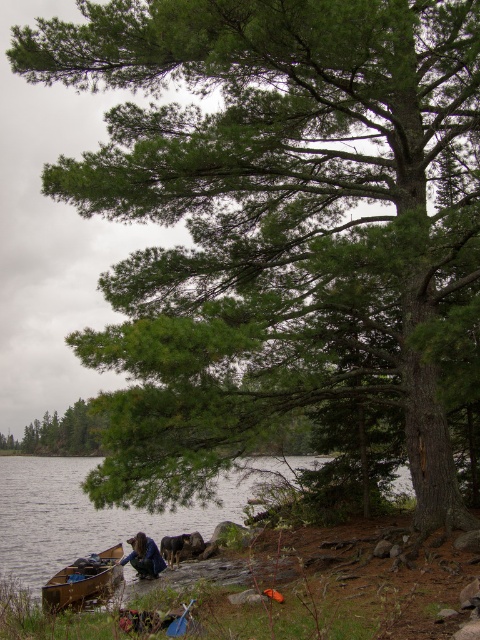
Image resolution: width=480 pixels, height=640 pixels. What do you see at coordinates (84, 579) in the screenshot? I see `wooden canoe at lower left` at bounding box center [84, 579].

Can you confirm if wooden canoe at lower left is thinner than dark blue fabric at lower center?

Incorrect, wooden canoe at lower left's width is not less than dark blue fabric at lower center's.

Is point (82, 573) positioned behind point (133, 552)?

No, it is not.

Image resolution: width=480 pixels, height=640 pixels. In order to click on wooden canoe at lower left in this screenshot , I will do `click(84, 579)`.

Describe the element at coordinates (60, 433) in the screenshot. I see `green matte tree at center` at that location.

Between green matte tree at center and wooden canoe at lower left, which one appears on the right side from the viewer's perspective?

From the viewer's perspective, wooden canoe at lower left appears more on the right side.

Find the location of a particular element. This screenshot has height=640, width=480. green matte tree at center is located at coordinates (60, 433).

Where is `green matte tree at center`? The width and height of the screenshot is (480, 640). green matte tree at center is located at coordinates tap(60, 433).

Who is shorter, green matte tree at center or dark blue fabric at lower center?

dark blue fabric at lower center

Measure the distance between green matte tree at center and camera.

green matte tree at center and camera are 73.12 feet apart from each other.

Between point (88, 424) and point (144, 572), which one is positioned behind?

The point (88, 424) is more distant.

This screenshot has height=640, width=480. I want to click on green matte tree at center, so click(60, 433).